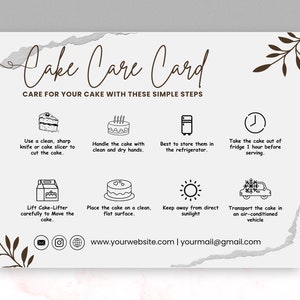
Identify the location of pink-tinged white bar. (145, 283).